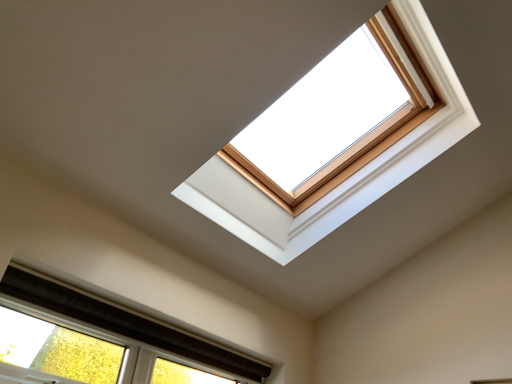
Measure the distance between point [136,320] and camera.

They are 5.73 feet apart.

The width and height of the screenshot is (512, 384). Identify the location of matte black curtain at lower left. (125, 323).

What do you see at coordinates (125, 323) in the screenshot? This screenshot has width=512, height=384. I see `matte black curtain at lower left` at bounding box center [125, 323].

What is the approximate height of matte black curtain at lower left?

4.51 inches.

At what (x,y) coordinates should I click in order to perform the action: click on matte black curtain at lower left. Please return your answer as a coordinate pair (x, y). Image resolution: width=512 pixels, height=384 pixels. Looking at the image, I should click on (125, 323).